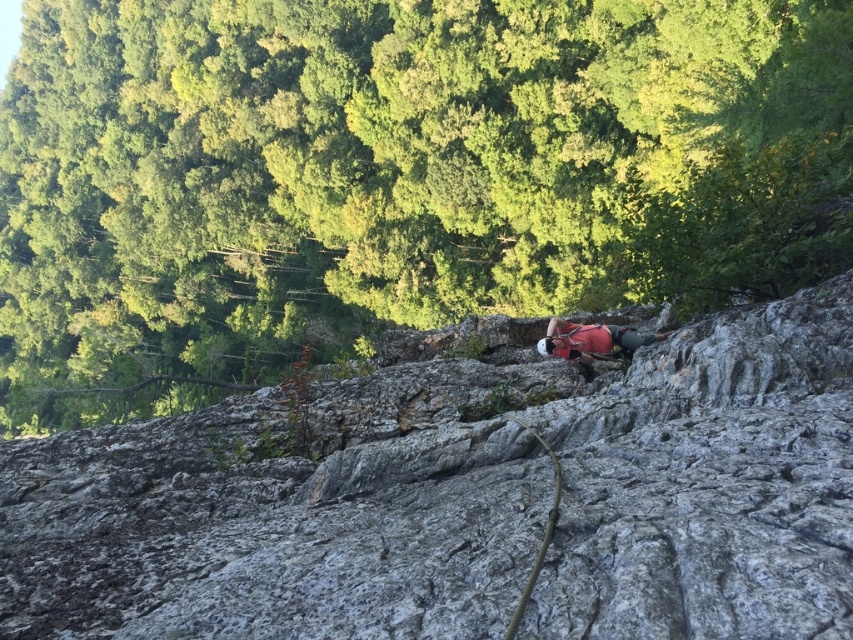
In the scene shown: Can you confirm if green leafy tree at upper center is positioned above matte red shirt at center?

Yes, green leafy tree at upper center is above matte red shirt at center.

Measure the distance between green leafy tree at upper center and camera.

green leafy tree at upper center and camera are 7.22 meters apart from each other.

At what (x,y) coordinates should I click in order to perform the action: click on green leafy tree at upper center. Please return your answer as a coordinate pair (x, y). Looking at the image, I should click on (393, 177).

Who is more forward, (105, 577) or (521, 611)?

Point (521, 611)

Can you confirm if gray rough rock at center is thinner than green rubber rope at center?

No, gray rough rock at center is not thinner than green rubber rope at center.

Is point (788, 353) closer to camera compared to point (521, 593)?

No, (788, 353) is behind (521, 593).

Locate an element on the screen. gray rough rock at center is located at coordinates (463, 497).

Can you confirm if matte red shirt at center is positioned to the right of green rubber rope at center?

Yes, matte red shirt at center is to the right of green rubber rope at center.

This screenshot has height=640, width=853. What do you see at coordinates (592, 340) in the screenshot?
I see `matte red shirt at center` at bounding box center [592, 340].

Identify the location of matte red shirt at center. (592, 340).